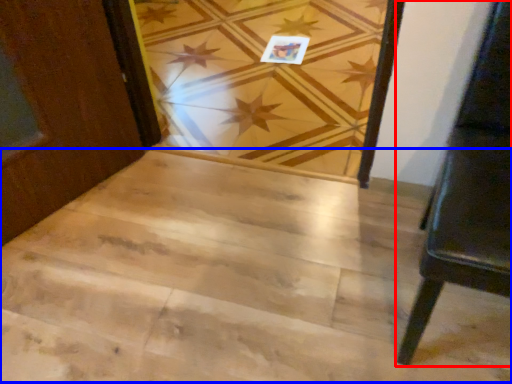
Question: Which object appears closest to the camera in this image, furniture (highlighted by a red box) or stairwell (highlighted by a blue box)?

Choices:
 (A) furniture
 (B) stairwell

Answer: (A)